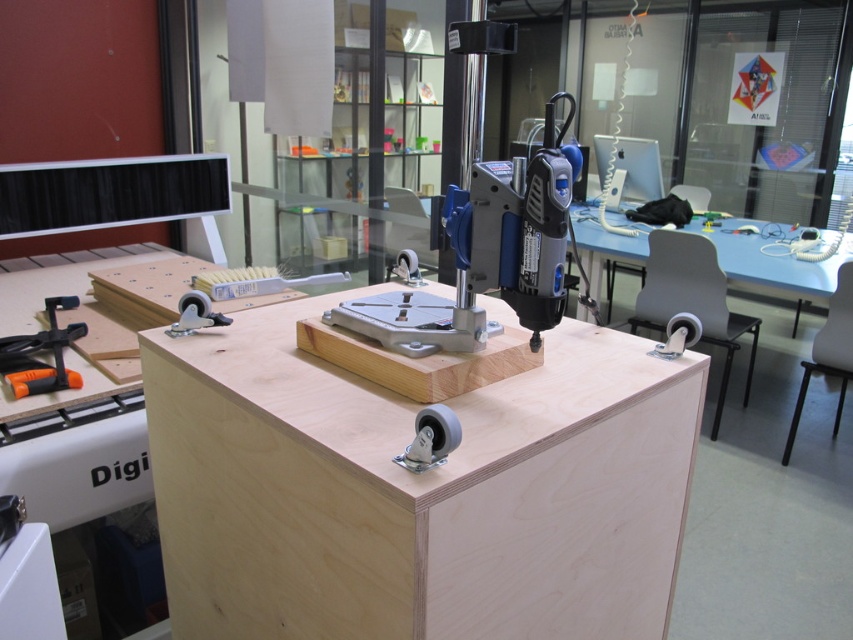
Between blue plastic drill at center and light blue plastic table at center, which one has less height?

blue plastic drill at center is shorter.

Does point (560, 132) come in front of point (709, 230)?

Yes, it is in front of point (709, 230).

Measure the distance between point (421, 324) and camera.

The distance of point (421, 324) from camera is 1.07 meters.

The width and height of the screenshot is (853, 640). Identify the location of blue plastic drill at center. (469, 256).

Between light blue plastic table at center and orange plastic clamp at lower left, which one appears on the left side from the viewer's perspective?

orange plastic clamp at lower left is more to the left.

Is point (764, 259) behind point (15, 381)?

Yes.

Find the location of a particular element. The image size is (853, 640). light blue plastic table at center is located at coordinates (770, 260).

Does plywood table at center have a lesser width compared to orange plastic clamp at lower left?

Incorrect, plywood table at center's width is not less than orange plastic clamp at lower left's.

Based on the photo, does plywood table at center have a smaller size compared to orange plastic clamp at lower left?

Incorrect, plywood table at center is not smaller in size than orange plastic clamp at lower left.

In order to click on plywood table at center in this screenshot , I will do `click(416, 490)`.

This screenshot has height=640, width=853. I want to click on plywood table at center, so click(416, 490).